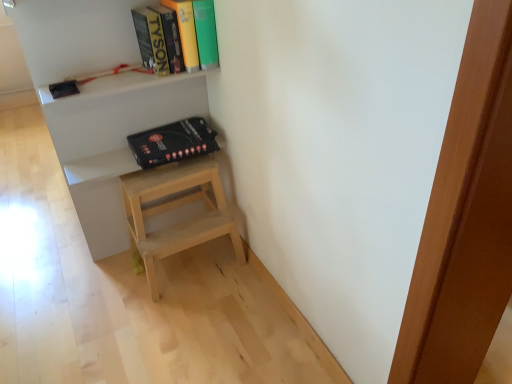
Question: Is black matte box at upper center not close to white matte shelf at upper center?

Choices:
 (A) yes
 (B) no

Answer: (B)

Question: From a real-world perspective, is black matte box at upper center on white matte shelf at upper center?

Choices:
 (A) no
 (B) yes

Answer: (A)

Question: Can you confirm if black matte box at upper center is wider than white matte shelf at upper center?

Choices:
 (A) no
 (B) yes

Answer: (B)

Question: Can you see black matte box at upper center touching white matte shelf at upper center?

Choices:
 (A) yes
 (B) no

Answer: (B)

Question: Can you confirm if black matte box at upper center is shorter than white matte shelf at upper center?

Choices:
 (A) yes
 (B) no

Answer: (A)

Question: Is the depth of black matte box at upper center less than that of white matte shelf at upper center?

Choices:
 (A) no
 (B) yes

Answer: (A)

Question: Is white matte shelf at upper center to the right of black matte box at upper center from the viewer's perspective?

Choices:
 (A) yes
 (B) no

Answer: (B)

Question: Does white matte shelf at upper center have a lesser width compared to black matte box at upper center?

Choices:
 (A) no
 (B) yes

Answer: (B)

Question: Are white matte shelf at upper center and black matte box at upper center beside each other?

Choices:
 (A) yes
 (B) no

Answer: (B)

Question: Does white matte shelf at upper center come behind black matte box at upper center?

Choices:
 (A) no
 (B) yes

Answer: (A)

Question: Is white matte shelf at upper center wider than black matte box at upper center?

Choices:
 (A) yes
 (B) no

Answer: (B)

Question: Considering the relative sizes of white matte shelf at upper center and black matte box at upper center in the image provided, is white matte shelf at upper center shorter than black matte box at upper center?

Choices:
 (A) yes
 (B) no

Answer: (B)

Question: Is hardcover book at upper center positioned before black matte box at upper center?

Choices:
 (A) no
 (B) yes

Answer: (B)